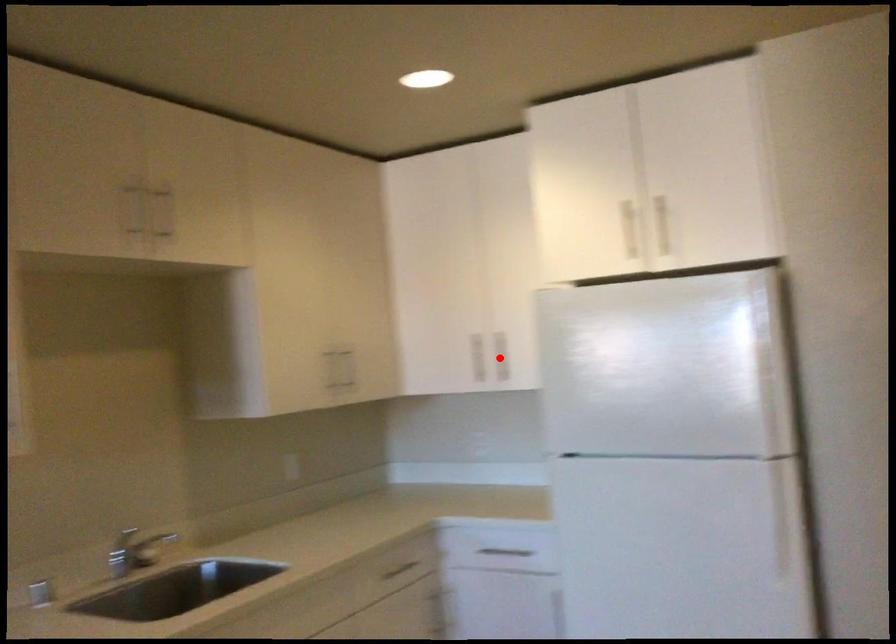
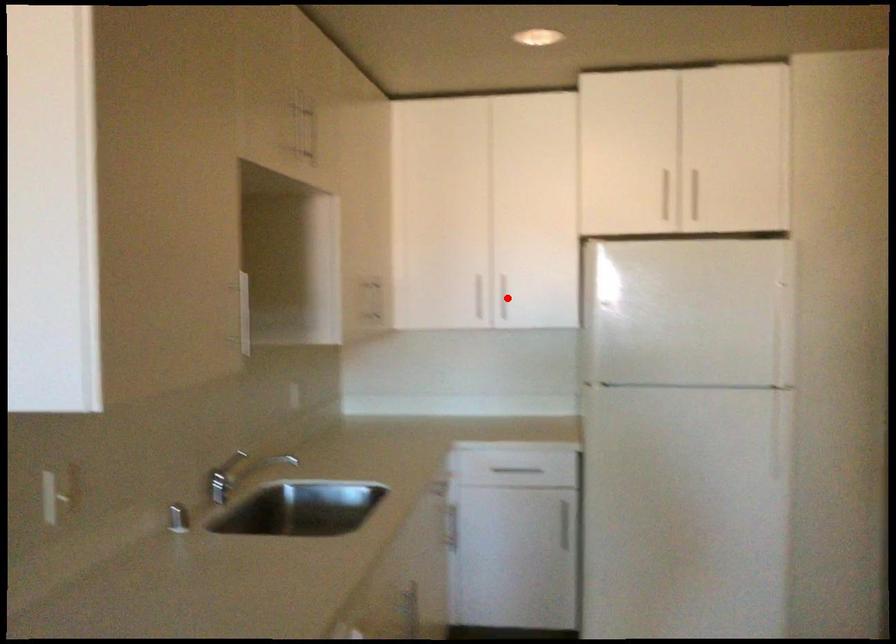
I am providing you with two images of the same scene from different viewpoints. A red point is marked on the first image and another point is marked on the second image. Does the point marked in image1 correspond to the same location as the one in image2?

Yes